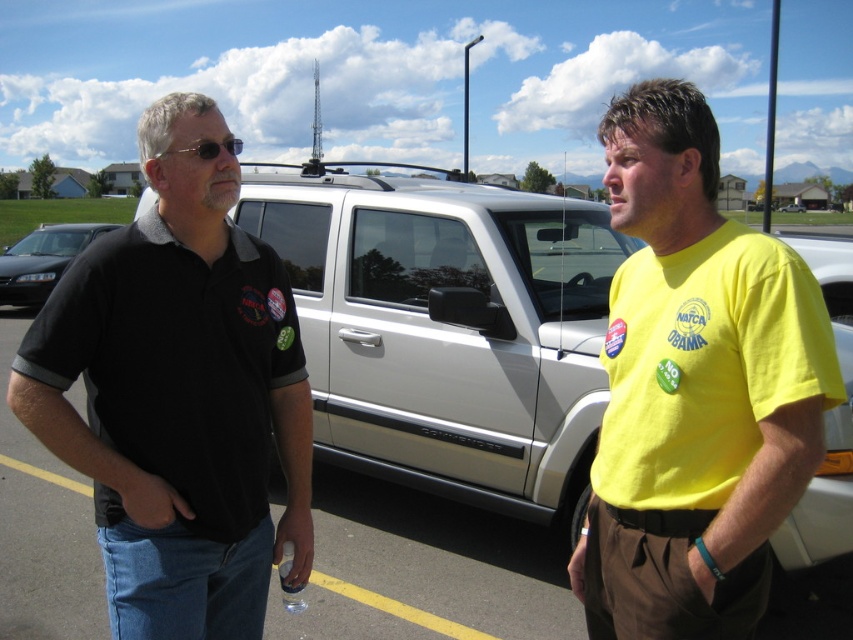
You are a photographer trying to capture both the black matte shirt at left and the white matte truck at center in a single frame. Since you can only focus on one subject at a time, which one should you focus on to ensure the other remains in the background?

You should focus on the black matte shirt at left because it is in front of the white matte truck at center, so the truck will naturally be in the background.